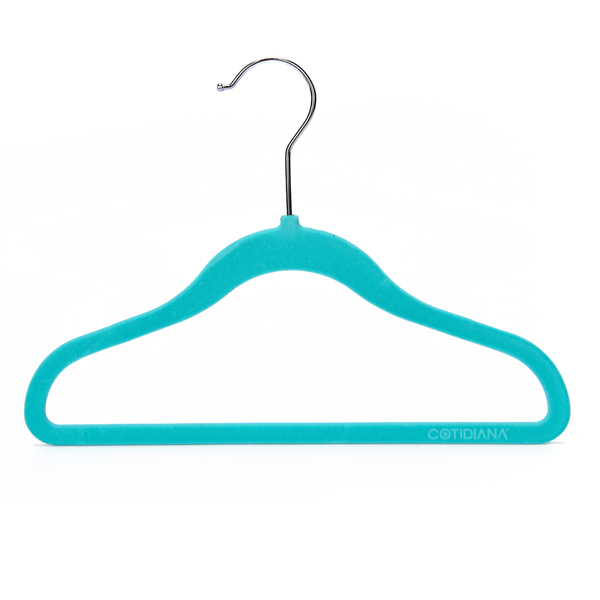
Pinpoint the coordinates of where you'd put clothes in the image. Your answer should be formatted as a list of tuples, i.e. [(x1, y1), (x2, y2), ...], where each tuple contains the x and y coordinates of a point satisfying the conditions above.

[(293, 436)]